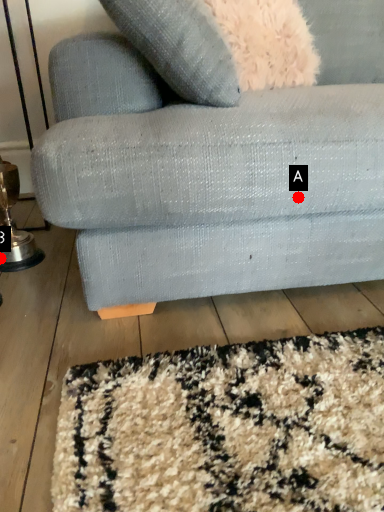
Question: Two points are circled on the image, labeled by A and B beside each circle. Among these points, which one is farthest from the camera?

Choices:
 (A) A is further
 (B) B is further

Answer: (B)